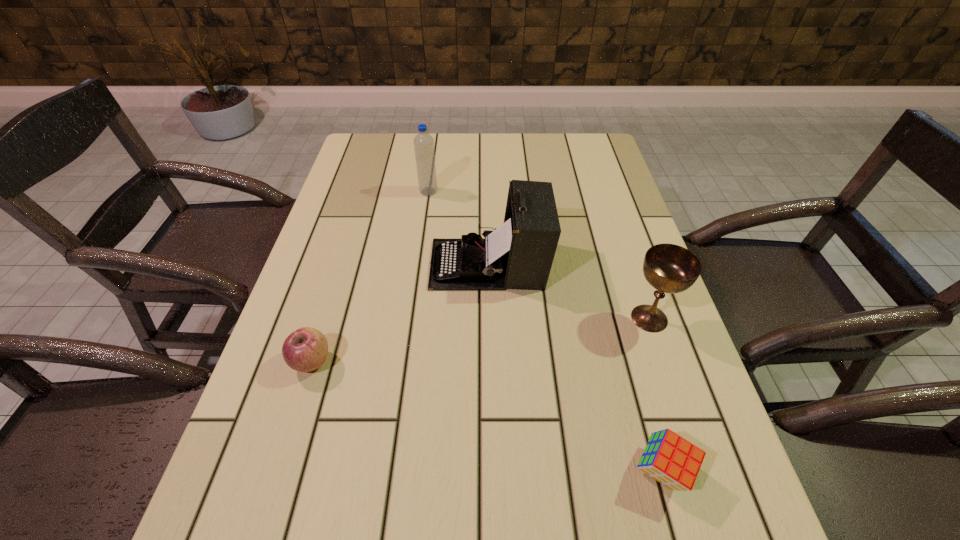
Locate an element on the screen. free space between the cube and the leftmost object is located at coordinates (487, 417).

You are a GUI agent. You are given a task and a screenshot of the screen. Output one action in this format:
    pyautogui.click(x=<x>, y=<y>)
    Task: Click on the unoccupied area between the farthest object and the cube
    The height and width of the screenshot is (540, 960).
    Given the screenshot: What is the action you would take?
    pyautogui.click(x=545, y=332)

Identify which object is located as the fourth nearest to the nearest object. Please provide its 2D coordinates. Your answer should be formatted as a tuple, i.e. [(x, y)], where the tuple contains the x and y coordinates of a point satisfying the conditions above.

[(423, 142)]

Image resolution: width=960 pixels, height=540 pixels. In order to click on object that stands as the second closest to the typewriter in this screenshot , I will do `click(423, 142)`.

Identify the location of free space that satisfies the following two spatial constraints: 1. on the front side of the nearest object; 2. on the left side of the second nearest object. The image size is (960, 540). (277, 471).

Locate an element on the screen. This screenshot has height=540, width=960. vacant space that satisfies the following two spatial constraints: 1. on the back side of the nearest object; 2. inside the open case of the fourth nearest object is located at coordinates (605, 264).

Identify the location of vacant region that satisfies the following two spatial constraints: 1. inside the open case of the typewriter; 2. on the front side of the fourth farthest object. (491, 362).